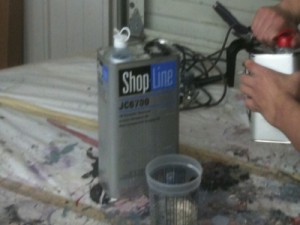
This screenshot has height=225, width=300. I want to click on cord, so (x=217, y=58).